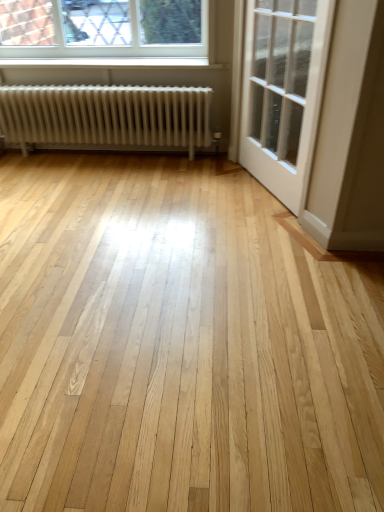
Where is `vacant area in front of white glossy door at upper right`? vacant area in front of white glossy door at upper right is located at coordinates (255, 229).